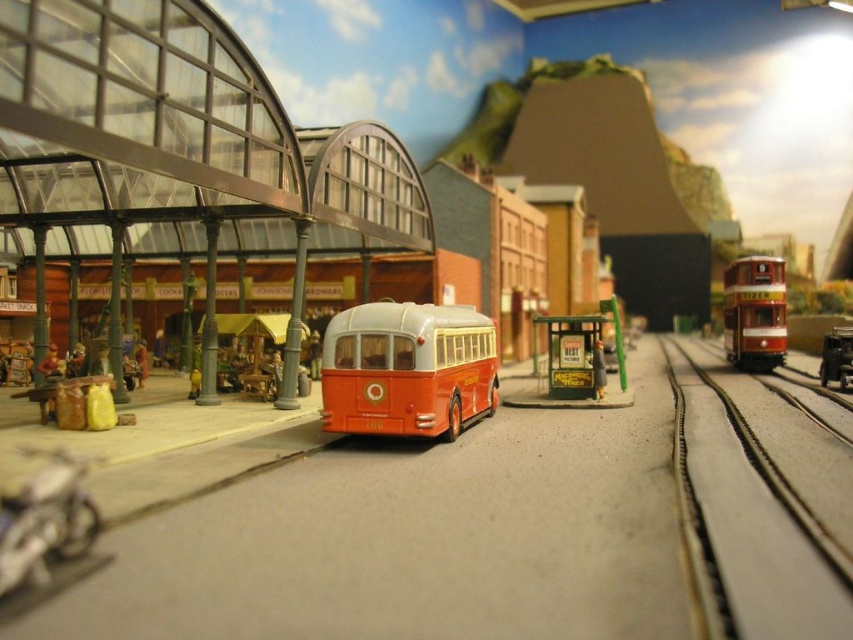
Can you confirm if matte orange bus at center is thinner than red polished wood tram at right?

No, matte orange bus at center is not thinner than red polished wood tram at right.

Based on the photo, measure the distance between matte orange bus at center and red polished wood tram at right.

matte orange bus at center is 10.62 feet away from red polished wood tram at right.

Who is more forward, (440,387) or (757,317)?

Point (440,387) is more forward.

The width and height of the screenshot is (853, 640). Find the location of `matte orange bus at center`. matte orange bus at center is located at coordinates (407, 369).

Which of these two, metallic silver train tracks at right or matte orange bus at center, stands shorter?

Standing shorter between the two is metallic silver train tracks at right.

Which is above, metallic silver train tracks at right or matte orange bus at center?

matte orange bus at center

What do you see at coordinates (747, 525) in the screenshot?
I see `metallic silver train tracks at right` at bounding box center [747, 525].

The height and width of the screenshot is (640, 853). Find the location of `metallic silver train tracks at right`. metallic silver train tracks at right is located at coordinates (747, 525).

Who is more forward, (693, 499) or (773, 364)?

Positioned in front is point (693, 499).

Is point (753, 525) positioned behind point (767, 308)?

No, (753, 525) is in front of (767, 308).

Find the location of `metallic silver train tracks at right`. metallic silver train tracks at right is located at coordinates (747, 525).

This screenshot has height=640, width=853. I want to click on metallic silver train tracks at right, so click(747, 525).